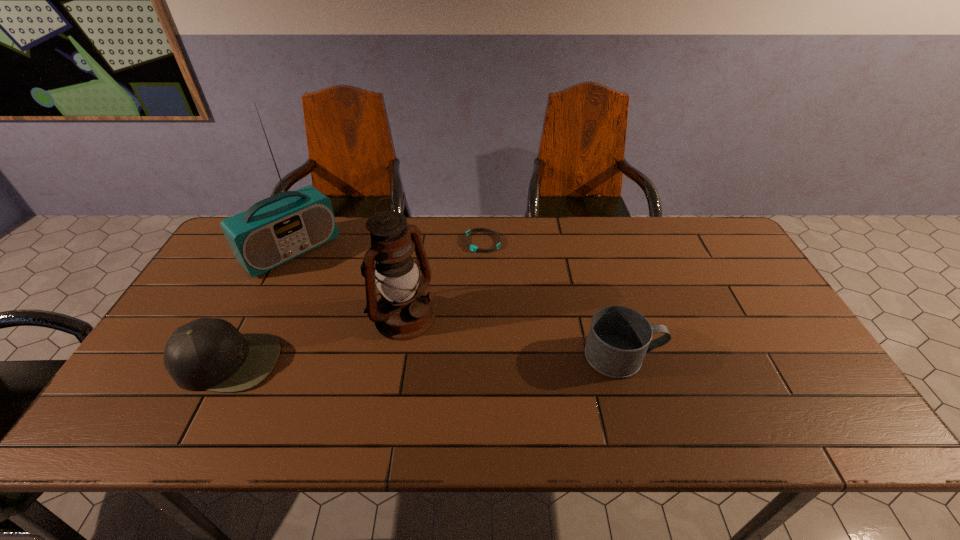
Where is `free spot on the desktop that is between the cap and the rightmost object and is positioned on the front panel of the radio receiver`? free spot on the desktop that is between the cap and the rightmost object and is positioned on the front panel of the radio receiver is located at coordinates (405, 359).

You are a GUI agent. You are given a task and a screenshot of the screen. Output one action in this format:
    pyautogui.click(x=<x>, y=<y>)
    Task: Click on the vacant space on the desktop that is between the cap and the mug and is positioned on the side of the second tallest object, there is a wick adjustment knob
    
    Given the screenshot: What is the action you would take?
    pyautogui.click(x=460, y=359)

Find the location of a particular element. The image size is (960, 540). vacant spot on the desktop that is between the cap and the mug and is positioned on the buckle of the wristband is located at coordinates (398, 359).